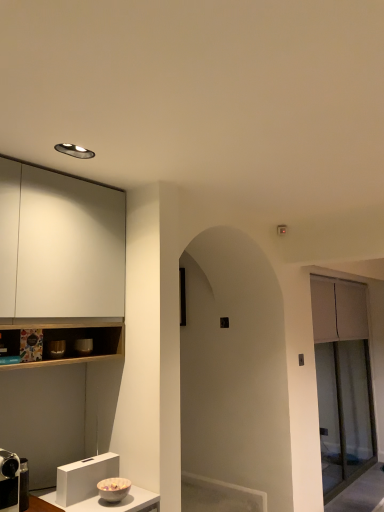
Question: In terms of width, does metallic silver camera at lower left, the first appliance viewed from the left, look wider or thinner when compared to clear glass screen door at right?

Choices:
 (A) thin
 (B) wide

Answer: (B)

Question: From their relative heights in the image, would you say metallic silver camera at lower left, the third appliance from the top, is taller or shorter than clear glass screen door at right?

Choices:
 (A) tall
 (B) short

Answer: (B)

Question: Based on their relative distances, which object is nearer to the matte silver bowl at left, positioned as the 2th appliance in right-to-left order?

Choices:
 (A) matte ceramic bowl at left, arranged as the second appliance when viewed from the top
 (B) metallic silver camera at lower left, the 3th appliance from the back
 (C) clear glass screen door at right

Answer: (A)

Question: Considering the real-world distances, which object is closest to the matte ceramic bowl at left, arranged as the second appliance when viewed from the top?

Choices:
 (A) matte silver bowl at left, which appears as the second appliance when viewed from the left
 (B) clear glass screen door at right
 (C) metallic silver camera at lower left, which is the first appliance in front-to-back order

Answer: (A)